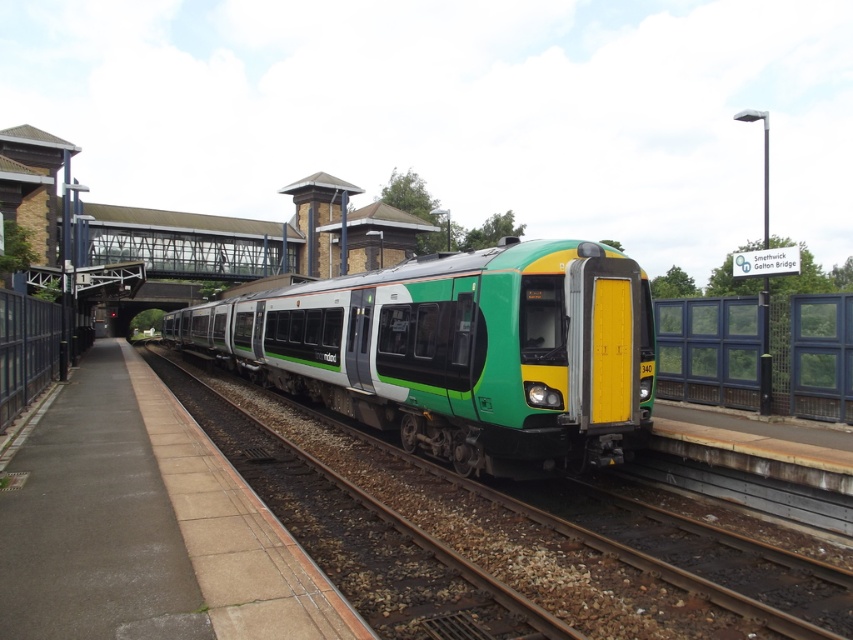
Question: Does green matte train at center appear on the right side of green metallic train at center?

Choices:
 (A) yes
 (B) no

Answer: (B)

Question: Is green matte train at center further to camera compared to green metallic train at center?

Choices:
 (A) no
 (B) yes

Answer: (B)

Question: Which point is closer to the camera?

Choices:
 (A) green metallic train at center
 (B) green matte train at center

Answer: (A)

Question: Does green matte train at center appear on the right side of green metallic train at center?

Choices:
 (A) yes
 (B) no

Answer: (B)

Question: Which point is farther to the camera?

Choices:
 (A) (445, 333)
 (B) (451, 522)

Answer: (A)